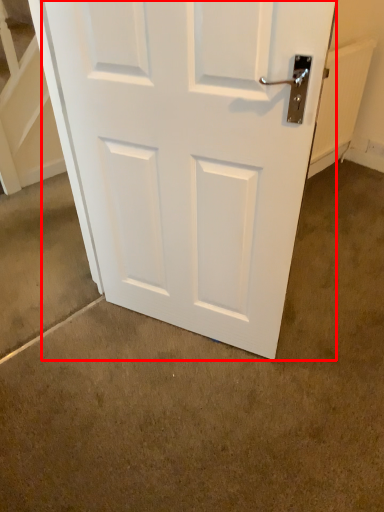
Question: From the image's perspective, what is the correct spatial relationship of door (annotated by the red box) in relation to concrete?

Choices:
 (A) below
 (B) above

Answer: (B)